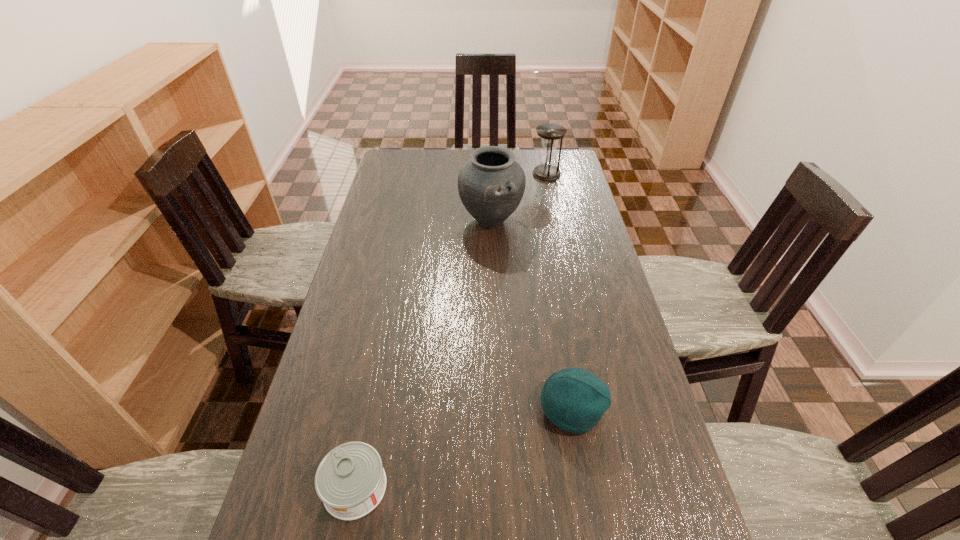
The width and height of the screenshot is (960, 540). What are the coordinates of `vacant space that satisfies the following two spatial constraints: 1. on the back side of the shortest object; 2. on the right side of the urn` in the screenshot? It's located at (409, 220).

You are a GUI agent. You are given a task and a screenshot of the screen. Output one action in this format:
    pyautogui.click(x=<x>, y=<y>)
    Task: Click on the free point that satisfies the following two spatial constraints: 1. on the back side of the third nearest object; 2. on the left side of the leftmost object
    Image resolution: width=960 pixels, height=540 pixels.
    Given the screenshot: What is the action you would take?
    pyautogui.click(x=409, y=220)